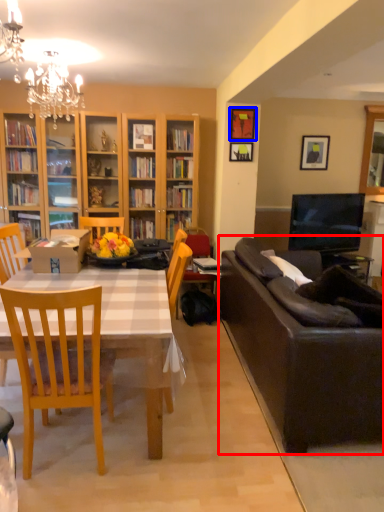
Question: Among these objects, which one is farthest to the camera, studio couch (highlighted by a red box) or picture frame (highlighted by a blue box)?

Choices:
 (A) studio couch
 (B) picture frame

Answer: (B)